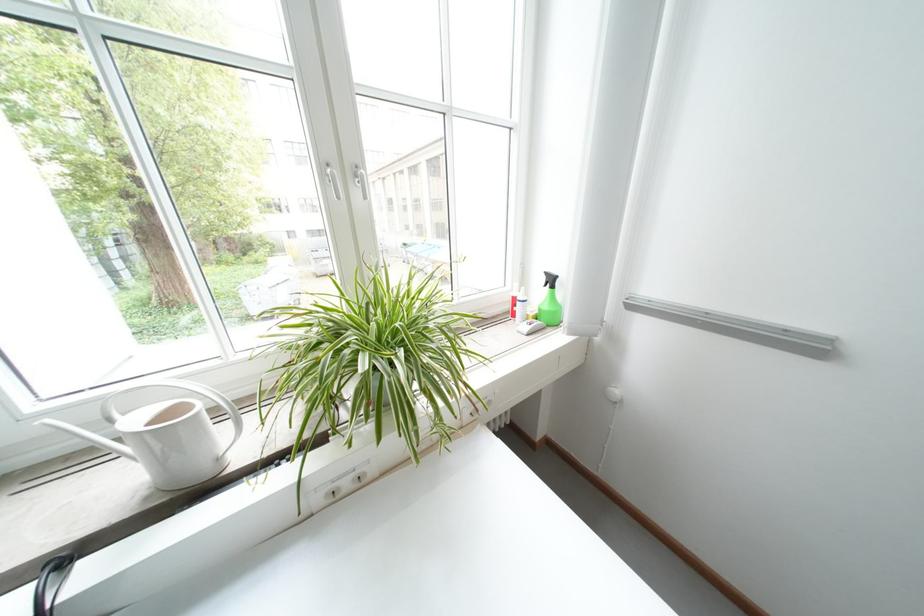
Locate an element on the screen. The width and height of the screenshot is (924, 616). white remote control is located at coordinates (529, 326).